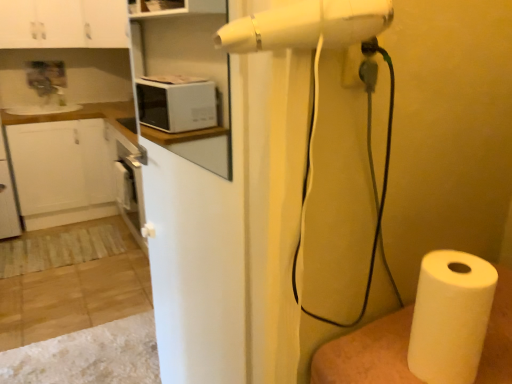
Question: Is white paper at lower right in contact with white matte microwave at upper left?

Choices:
 (A) yes
 (B) no

Answer: (B)

Question: Is white paper at lower right oriented towards white matte microwave at upper left?

Choices:
 (A) yes
 (B) no

Answer: (B)

Question: From a real-world perspective, does white paper at lower right stand above white matte microwave at upper left?

Choices:
 (A) yes
 (B) no

Answer: (B)

Question: Considering the relative positions of white paper at lower right and white matte microwave at upper left in the image provided, is white paper at lower right behind white matte microwave at upper left?

Choices:
 (A) no
 (B) yes

Answer: (A)

Question: From the image's perspective, would you say white paper at lower right is positioned over white matte microwave at upper left?

Choices:
 (A) no
 (B) yes

Answer: (A)

Question: In the image, is white paper at lower right positioned in front of or behind white matte microwave at upper left?

Choices:
 (A) behind
 (B) front

Answer: (B)

Question: Would you say white paper at lower right is to the left or to the right of white matte microwave at upper left in the picture?

Choices:
 (A) left
 (B) right

Answer: (B)

Question: From the image's perspective, is white paper at lower right located above or below white matte microwave at upper left?

Choices:
 (A) below
 (B) above

Answer: (A)

Question: From a real-world perspective, relative to white matte microwave at upper left, is white paper at lower right vertically above or below?

Choices:
 (A) above
 (B) below

Answer: (B)

Question: Does point (95, 29) appear closer or farther from the camera than point (98, 1)?

Choices:
 (A) closer
 (B) farther

Answer: (B)

Question: From the image's perspective, is white glossy cabinet at upper left, which is the first cabinetry in right-to-left order, above or below white glossy cabinet at upper left, placed as the second cabinetry when sorted from right to left?

Choices:
 (A) above
 (B) below

Answer: (A)

Question: From a real-world perspective, is white glossy cabinet at upper left, which is the first cabinetry in right-to-left order, positioned above or below white glossy cabinet at upper left, placed as the second cabinetry when sorted from right to left?

Choices:
 (A) below
 (B) above

Answer: (A)

Question: Is white glossy cabinet at upper left, which is the first cabinetry in right-to-left order, taller or shorter than white glossy cabinet at upper left, which ranks as the 1th cabinetry in left-to-right order?

Choices:
 (A) short
 (B) tall

Answer: (B)

Question: In terms of size, does white paper at lower right appear bigger or smaller than white glossy cabinet at upper left, placed as the second cabinetry when sorted from right to left?

Choices:
 (A) small
 (B) big

Answer: (B)

Question: From their relative heights in the image, would you say white paper at lower right is taller or shorter than white glossy cabinet at upper left, placed as the second cabinetry when sorted from right to left?

Choices:
 (A) short
 (B) tall

Answer: (B)